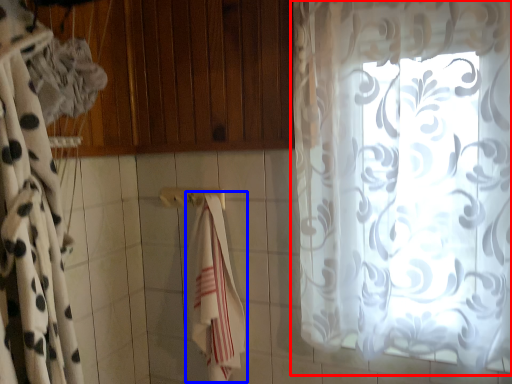
Question: Which object is further to the camera taking this photo, curtain (highlighted by a red box) or beach towel (highlighted by a blue box)?

Choices:
 (A) curtain
 (B) beach towel

Answer: (B)